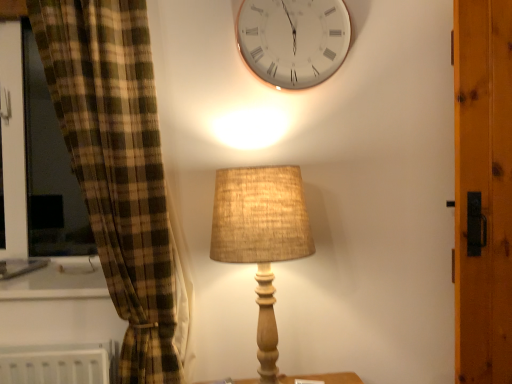
Question: Is burlap lampshade at center wider or thinner than white glossy clock at upper center?

Choices:
 (A) wide
 (B) thin

Answer: (A)

Question: Is burlap lampshade at center spatially inside white glossy clock at upper center, or outside of it?

Choices:
 (A) outside
 (B) inside

Answer: (A)

Question: From a real-world perspective, is burlap lampshade at center physically located above or below white glossy clock at upper center?

Choices:
 (A) above
 (B) below

Answer: (B)

Question: Considering their positions, is white glossy clock at upper center located in front of or behind burlap lampshade at center?

Choices:
 (A) front
 (B) behind

Answer: (B)

Question: From their relative heights in the image, would you say white glossy clock at upper center is taller or shorter than burlap lampshade at center?

Choices:
 (A) short
 (B) tall

Answer: (A)

Question: Is white glossy clock at upper center inside the boundaries of burlap lampshade at center, or outside?

Choices:
 (A) outside
 (B) inside

Answer: (A)

Question: Is point (350, 38) closer or farther from the camera than point (241, 221)?

Choices:
 (A) farther
 (B) closer

Answer: (A)